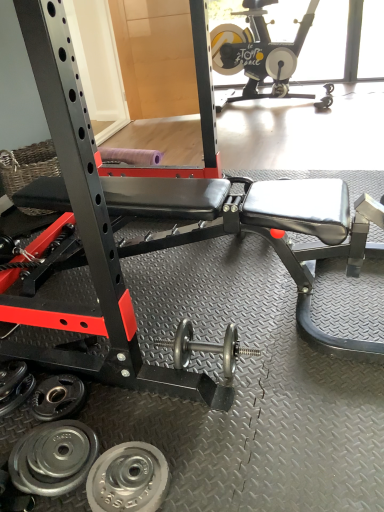
Where is `free space that is in between silver metallic weight plate at lower left, which ranks as the first wheel in front-to-back order, and polished silver dumbbell at center`? free space that is in between silver metallic weight plate at lower left, which ranks as the first wheel in front-to-back order, and polished silver dumbbell at center is located at coordinates (185, 426).